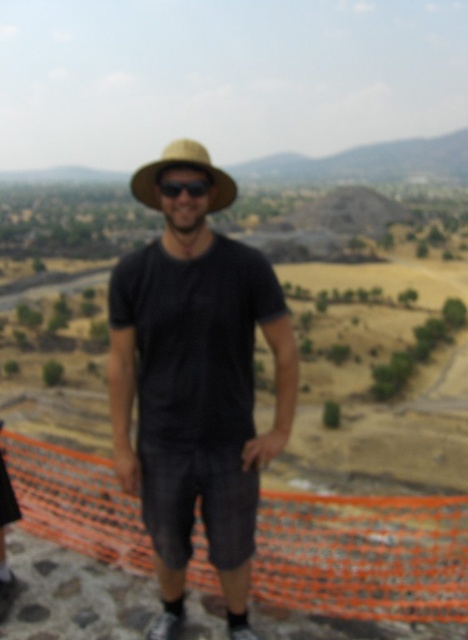
You are a photographer trying to capture a clear shot of the person in the scene. Since the image is slightly blurred, you need to focus on the object that takes up more space. Which object should you focus on between the matte black shirt at center and the black matte sunglasses at center?

The matte black shirt at center is larger in size than the black matte sunglasses at center, so you should focus on the matte black shirt at center as it takes up more space in the image.

You are navigating through the scenic area and need to reach a specific point. You are currently at point (190, 180) and want to go to point (284, 380). Based on the image, is the destination point behind or in front of your current position?

The destination point (284, 380) is behind your current position at point (190, 180) according to the image.

You are standing at the point marked by the coordinates point (219, 180) in the image. You want to walk directly towards the pyramid or mound in the distance. How far will you have to walk to reach the base of the structure?

The distance between you and the pyramid or mound cannot be determined with the given information.